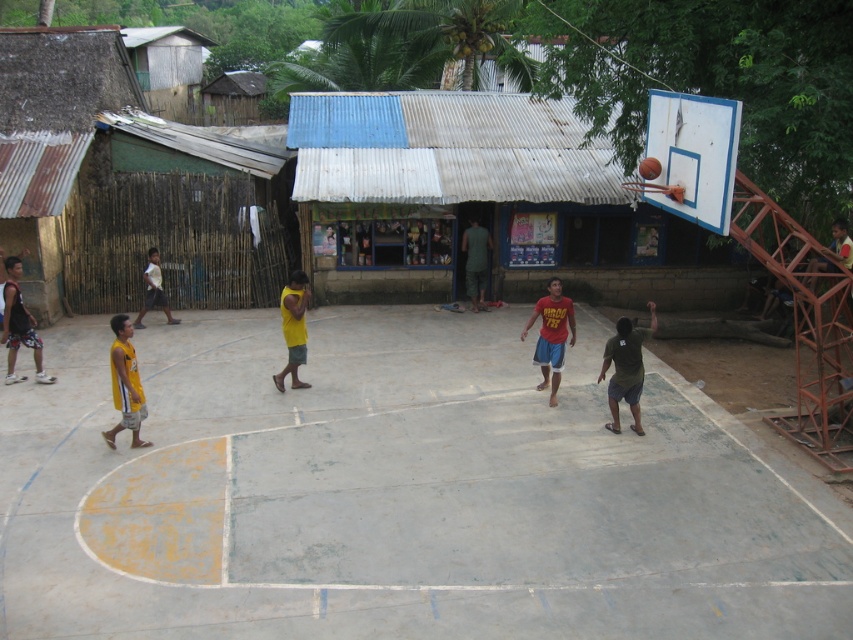
Between blue painted metal basketball hoop at upper right and dark green shirt at center, which one appears on the right side from the viewer's perspective?

Positioned to the right is blue painted metal basketball hoop at upper right.

From the picture: Does blue painted metal basketball hoop at upper right appear on the right side of dark green shirt at center?

Indeed, blue painted metal basketball hoop at upper right is positioned on the right side of dark green shirt at center.

At what (x,y) coordinates should I click in order to perform the action: click on blue painted metal basketball hoop at upper right. Please return your answer as a coordinate pair (x, y). Looking at the image, I should click on (691, 156).

Can you confirm if blue painted metal basketball hoop at upper right is taller than yellow fabric shirt at left?

Yes, blue painted metal basketball hoop at upper right is taller than yellow fabric shirt at left.

Describe the element at coordinates (691, 156) in the screenshot. The image size is (853, 640). I see `blue painted metal basketball hoop at upper right` at that location.

I want to click on blue painted metal basketball hoop at upper right, so [691, 156].

Is point (619, 396) positioned before point (35, 356)?

Yes, point (619, 396) is in front of point (35, 356).

Who is taller, dark green shirt at center or matte black shorts at left?

matte black shorts at left

Image resolution: width=853 pixels, height=640 pixels. What do you see at coordinates (625, 369) in the screenshot?
I see `dark green shirt at center` at bounding box center [625, 369].

What are the coordinates of `dark green shirt at center` in the screenshot? It's located at (625, 369).